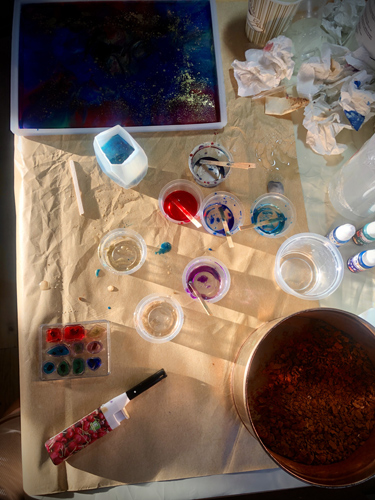
Locate an element on the screen. This screenshot has height=500, width=375. resin pot is located at coordinates (279, 392).